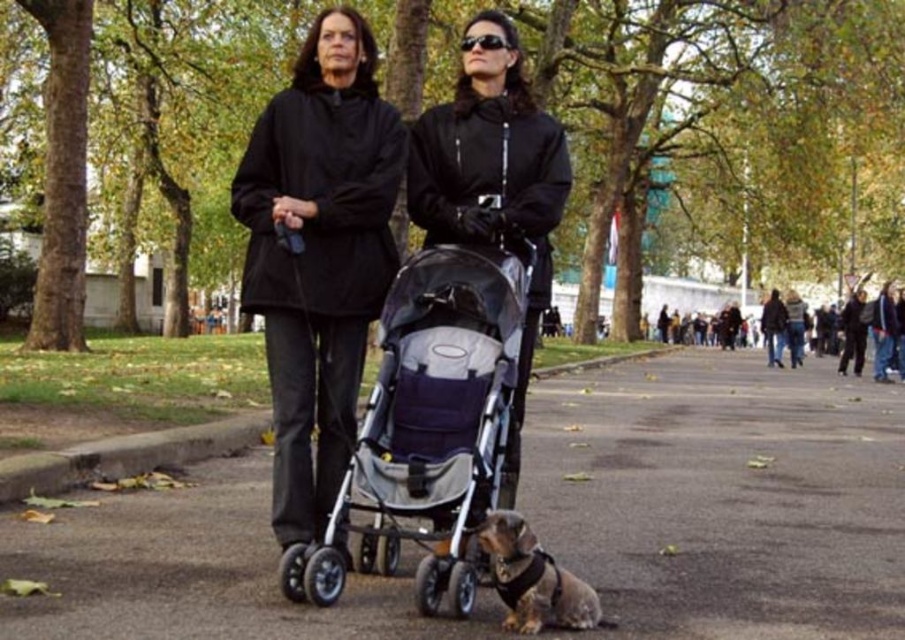
The width and height of the screenshot is (905, 640). I want to click on brown fur dog at lower center, so click(x=532, y=579).

Between brown fur dog at lower center and black plastic sunglasses at center, which one has more height?

Standing taller between the two is brown fur dog at lower center.

Find the location of a particular element. This screenshot has width=905, height=640. brown fur dog at lower center is located at coordinates (532, 579).

Does metallic stroller at center have a greater width compared to black plastic sunglasses at center?

Yes.

Can you confirm if metallic stroller at center is positioned above black plastic sunglasses at center?

Incorrect, metallic stroller at center is not positioned above black plastic sunglasses at center.

Which is in front, point (639, 524) or point (470, 38)?

Point (470, 38) is in front.

I want to click on metallic stroller at center, so click(x=724, y=497).

Can you confirm if black matte coat at center is taller than black plastic sunglasses at center?

Yes, black matte coat at center is taller than black plastic sunglasses at center.

Image resolution: width=905 pixels, height=640 pixels. I want to click on black matte coat at center, so click(318, 253).

The width and height of the screenshot is (905, 640). Find the location of `black matte coat at center`. black matte coat at center is located at coordinates (318, 253).